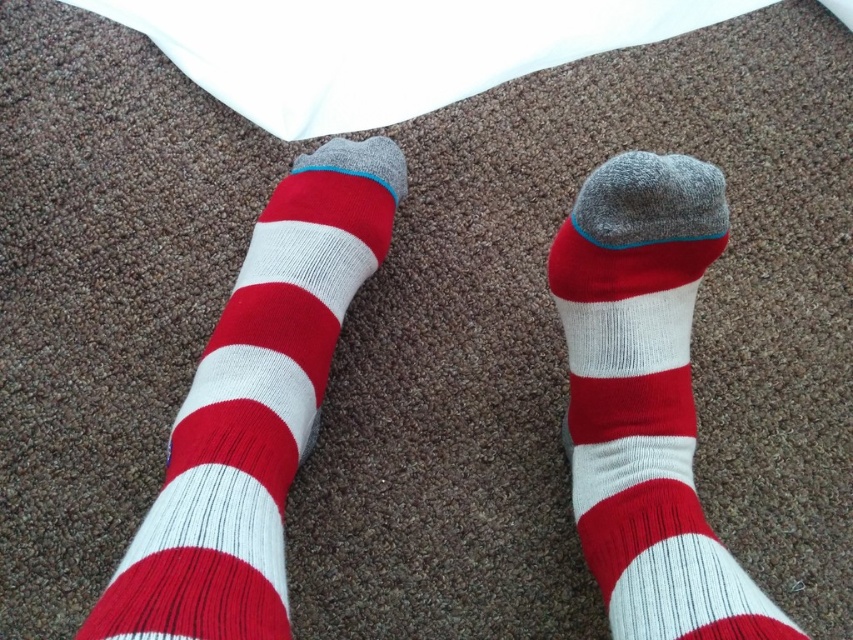
Question: Which object appears farthest from the camera in this image?

Choices:
 (A) matte white/red striped sock at center
 (B) red/white striped sock at center

Answer: (A)

Question: Is red/white striped sock at center bigger than matte white/red striped sock at center?

Choices:
 (A) no
 (B) yes

Answer: (B)

Question: Can you confirm if red/white striped sock at center is thinner than matte white/red striped sock at center?

Choices:
 (A) no
 (B) yes

Answer: (A)

Question: Can you confirm if red/white striped sock at center is thinner than matte white/red striped sock at center?

Choices:
 (A) no
 (B) yes

Answer: (A)

Question: Which point is closer to the camera?

Choices:
 (A) red/white striped sock at center
 (B) matte white/red striped sock at center

Answer: (A)

Question: Which point is farther to the camera?

Choices:
 (A) red/white striped sock at center
 (B) matte white/red striped sock at center

Answer: (B)